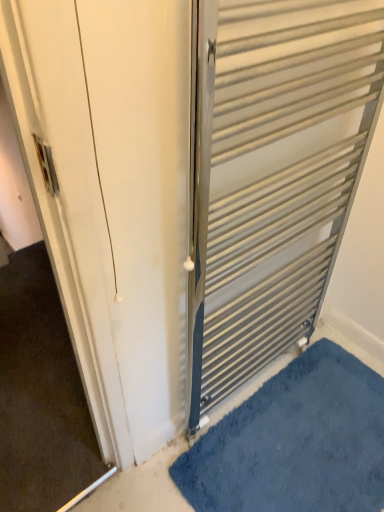
Question: Considering the positions of metallic silver radiator at right and blue shaggy bath mat at lower right in the image, is metallic silver radiator at right bigger or smaller than blue shaggy bath mat at lower right?

Choices:
 (A) big
 (B) small

Answer: (A)

Question: Considering the positions of point (294, 261) and point (344, 433), is point (294, 261) closer or farther from the camera than point (344, 433)?

Choices:
 (A) closer
 (B) farther

Answer: (A)

Question: From the image's perspective, is metallic silver radiator at right above or below blue shaggy bath mat at lower right?

Choices:
 (A) below
 (B) above

Answer: (B)

Question: From their relative heights in the image, would you say blue shaggy bath mat at lower right is taller or shorter than metallic silver radiator at right?

Choices:
 (A) tall
 (B) short

Answer: (B)

Question: Is blue shaggy bath mat at lower right bigger or smaller than metallic silver radiator at right?

Choices:
 (A) small
 (B) big

Answer: (A)

Question: Do you think blue shaggy bath mat at lower right is within metallic silver radiator at right, or outside of it?

Choices:
 (A) inside
 (B) outside

Answer: (B)

Question: From a real-world perspective, is blue shaggy bath mat at lower right positioned above or below metallic silver radiator at right?

Choices:
 (A) below
 (B) above

Answer: (A)